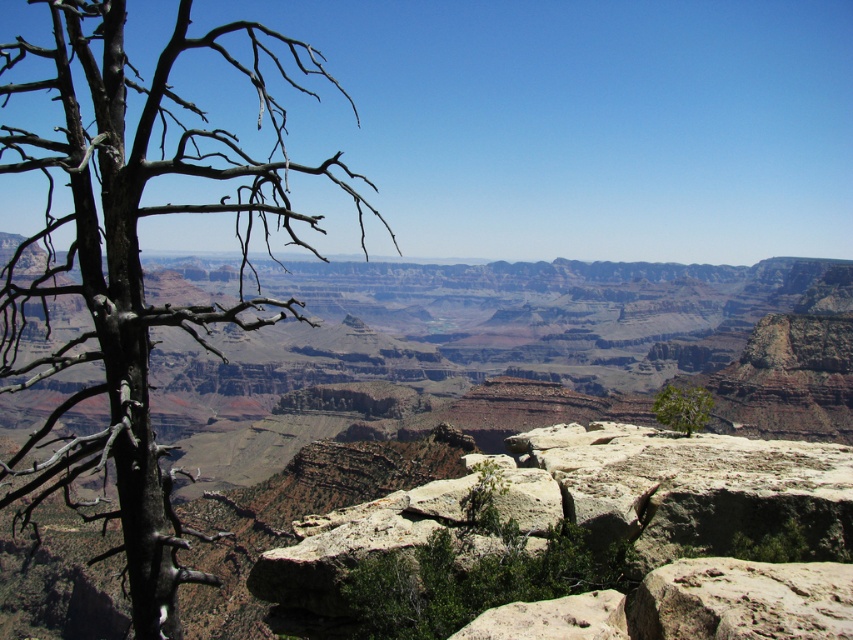
From the picture: Is brown/drytree at left positioned in front of green leafy tree at center?

Yes.

Is point (73, 4) positioned in front of point (653, 408)?

Yes, it is in front of point (653, 408).

Measure the distance between point (264, 305) and camera.

A distance of 939.77 feet exists between point (264, 305) and camera.

This screenshot has height=640, width=853. In order to click on brown/drytree at left in this screenshot , I will do `click(136, 260)`.